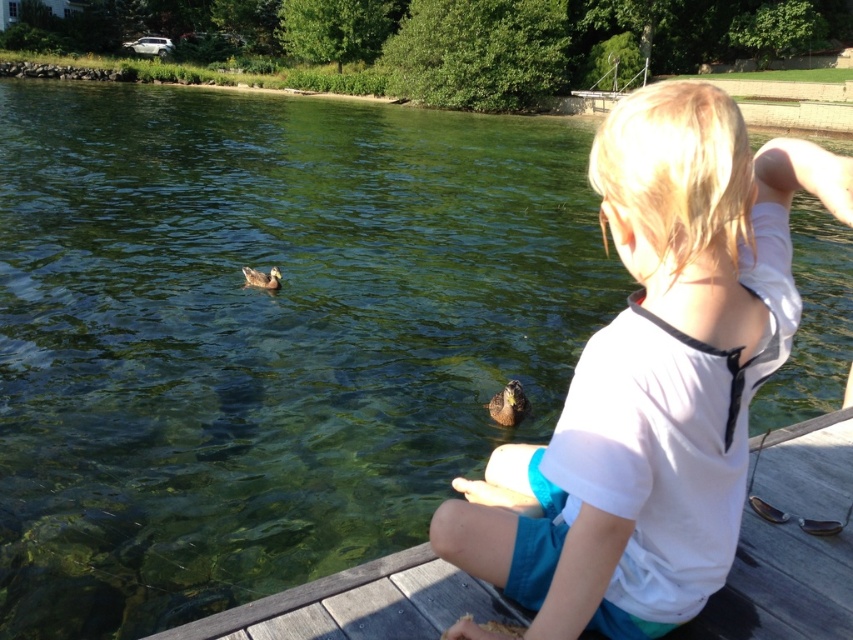
Can you confirm if white cotton shirt at center is positioned above brown fuzzy duck at lower center?

Yes.

Is white cotton shirt at center shorter than brown fuzzy duck at lower center?

No, white cotton shirt at center is not shorter than brown fuzzy duck at lower center.

What do you see at coordinates (653, 378) in the screenshot? The height and width of the screenshot is (640, 853). I see `white cotton shirt at center` at bounding box center [653, 378].

At what (x,y) coordinates should I click in order to perform the action: click on white cotton shirt at center. Please return your answer as a coordinate pair (x, y). Looking at the image, I should click on (653, 378).

Who is more distant from viewer, (770, 586) or (247, 284)?

The point (247, 284) is more distant.

This screenshot has height=640, width=853. Identify the location of wooden dock at lower center. (361, 604).

Measure the distance between point [692,417] and camera.

Point [692,417] is 1.77 meters from camera.

Can you confirm if white cotton shirt at center is bigger than brown matte duck at left?

Indeed, white cotton shirt at center has a larger size compared to brown matte duck at left.

Is point (695, 300) behind point (252, 268)?

No, it is not.

The width and height of the screenshot is (853, 640). I want to click on white cotton shirt at center, so click(x=653, y=378).